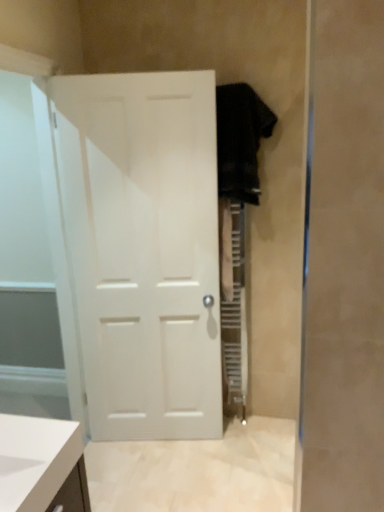
At what (x,y) coordinates should I click in order to perform the action: click on vacant area in front of white matte door at center. Please return your answer as a coordinate pair (x, y). This screenshot has width=384, height=512. Looking at the image, I should click on (174, 474).